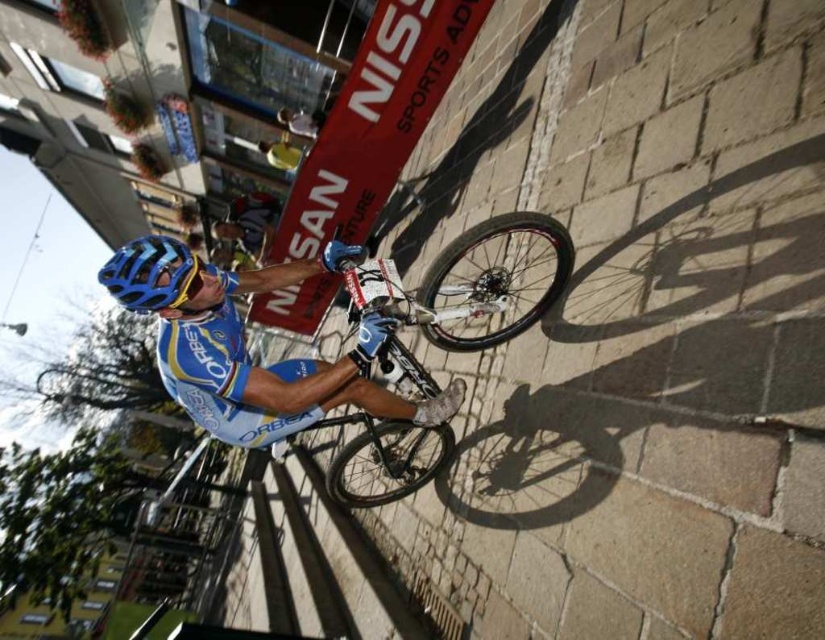
You are a photographer positioned at the origin point of the coordinate system. You want to capture the shiny metallic bicycle at center in your shot. What are the coordinates where you should aim your camera?

The coordinates to aim the camera are at point (465, 284).

You are a photographer trying to capture a closeup shot of both the shiny metallic bicycle at center and the blue matte bicycle helmet at center in the image. Your camera can only focus on objects within a 5 feet range. Can you fit both objects in the frame without moving the camera?

The shiny metallic bicycle at center and blue matte bicycle helmet at center are 5.34 feet apart from each other. Since the distance between them exceeds the 5 feet focus range of the camera, you cannot fit both objects in the frame without moving the camera.

Consider the image. You are a photographer positioned at the origin point of the coordinate system. You want to capture the cyclist and their bicycle in a single frame. Given that your camera has a 60 degree field of view, can you determine if the shiny metallic bicycle at center located at point (465, 284) will be within the frame if you are facing directly towards the cyclist?

The shiny metallic bicycle at center is located at point (465, 284). Since the photographer is at the origin and facing directly towards the cyclist, the bicycle is centered in the frame. With a 60 degree field of view, the bicycle at center would be well within the frame as it is positioned directly in front of the photographer.